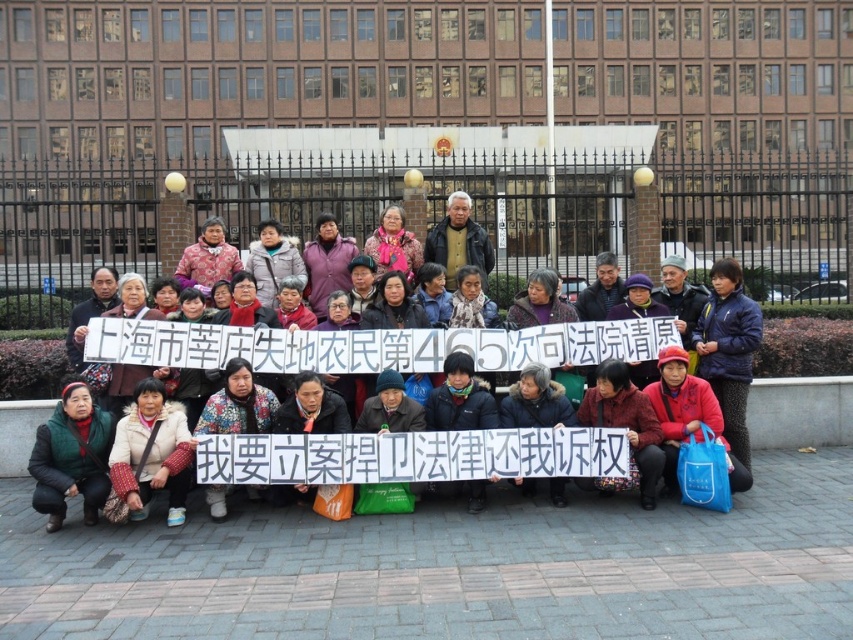
Question: Can you confirm if dark blue jacket at center is thinner than fluffy beige coat at lower center?

Choices:
 (A) yes
 (B) no

Answer: (B)

Question: Which object appears farthest from the camera in this image?

Choices:
 (A) fluffy beige coat at lower center
 (B) blue fleece jacket at center
 (C) green fuzzy vest at lower left

Answer: (B)

Question: Which of the following is the farthest from the observer?

Choices:
 (A) (86, 388)
 (B) (302, 348)
 (C) (164, 456)
 (D) (447, 243)

Answer: (D)

Question: Which point is closer to the camera?

Choices:
 (A) dark blue jacket at center
 (B) blue fleece jacket at center
 (C) dark gray jacket at center
 (D) green fuzzy vest at lower left

Answer: (D)

Question: Is dark blue jacket at center wider than dark gray jacket at center?

Choices:
 (A) no
 (B) yes

Answer: (A)

Question: Is dark blue jacket at center in front of blue fleece jacket at center?

Choices:
 (A) no
 (B) yes

Answer: (B)